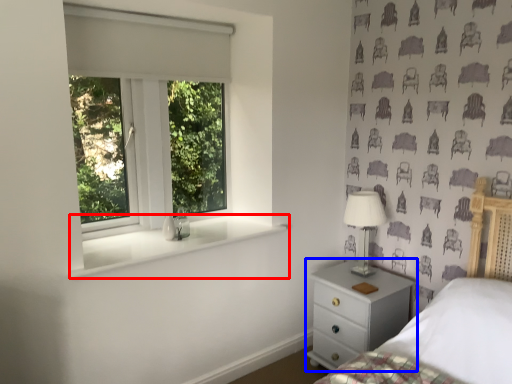
Question: Which object is closer to the camera taking this photo, window sill (highlighted by a red box) or chest of drawers (highlighted by a blue box)?

Choices:
 (A) window sill
 (B) chest of drawers

Answer: (A)